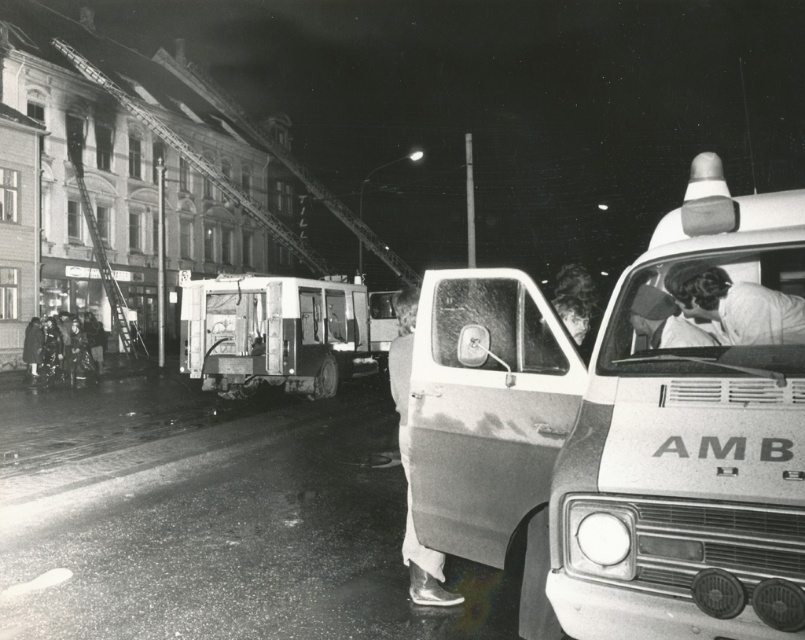
You are a pedestrian standing on the sidewalk across the street from the scene. You see the white plastic ambulance at center and the white matte uniform at center. Which object is closer to the ground?

The white plastic ambulance at center is closer to the ground because it is below the white matte uniform at center.

You are a drone operator trying to capture a clear aerial view of the emergency scene. The drone must avoid the white plastic ambulance at center. Given the ambulance is at coordinates point 0.673, 0.784, what is the safest direction to fly the drone to ensure it stays clear?

The safest direction to fly the drone away from the white plastic ambulance at center would be in the direction opposite to its coordinates, such as towards the lower left quadrant of the scene since the ambulance is positioned at point (630, 429).

You are a firefighter assessing the scene. You notice a white matte uniform at center and a metallic silver shoe at lower center. Which object is wider?

The white matte uniform at center is wider than the metallic silver shoe at lower center.